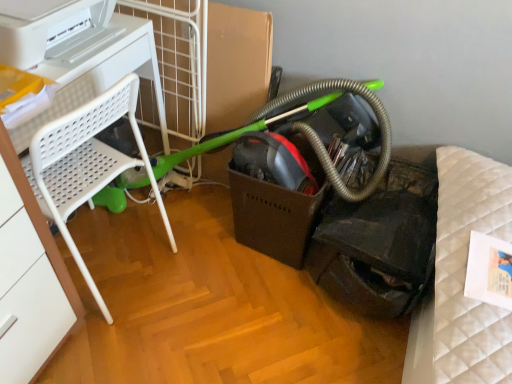
Describe the element at coordinates (81, 57) in the screenshot. This screenshot has width=512, height=384. I see `white plastic chair at left` at that location.

What do you see at coordinates (48, 28) in the screenshot? I see `white plastic printer at upper left` at bounding box center [48, 28].

Measure the distance between white plastic chair at left and camera.

The distance of white plastic chair at left from camera is 38.77 inches.

Image resolution: width=512 pixels, height=384 pixels. Find the location of `white plastic chair at left`. white plastic chair at left is located at coordinates (81, 57).

Which point is more forward, (x=68, y=141) or (x=96, y=196)?

The point (x=68, y=141) is closer.

Is white plastic chair at left wider than green rubber garden hose at center?

Correct, the width of white plastic chair at left exceeds that of green rubber garden hose at center.

From the image's perspective, between white plastic chair at left and green rubber garden hose at center, which one is located above?

green rubber garden hose at center appears higher in the image.

Does white plastic printer at upper left have a lesser height compared to green rubber garden hose at center?

Indeed, white plastic printer at upper left has a lesser height compared to green rubber garden hose at center.

Could you tell me if white plastic printer at upper left is turned towards green rubber garden hose at center?

No, white plastic printer at upper left is not facing towards green rubber garden hose at center.

Is point (84, 34) behind point (260, 127)?

No, (84, 34) is closer to viewer.

Is white plastic printer at upper left to the right of green rubber garden hose at center from the viewer's perspective?

In fact, white plastic printer at upper left is to the left of green rubber garden hose at center.

Considering the relative sizes of green rubber garden hose at center and white plastic printer at upper left in the image provided, is green rubber garden hose at center shorter than white plastic printer at upper left?

Incorrect, the height of green rubber garden hose at center does not fall short of that of white plastic printer at upper left.

Could you tell me if green rubber garden hose at center is facing white plastic printer at upper left?

No.

Considering the sizes of objects green rubber garden hose at center and white plastic printer at upper left in the image provided, who is thinner, green rubber garden hose at center or white plastic printer at upper left?

green rubber garden hose at center is thinner.

In the scene shown: Is green rubber garden hose at center to the left of white plastic printer at upper left from the viewer's perspective?

In fact, green rubber garden hose at center is to the right of white plastic printer at upper left.

Can you see white plastic chair at left touching white plastic printer at upper left?

Yes, white plastic chair at left is right next to white plastic printer at upper left and making contact.

From a real-world perspective, is white plastic chair at left on top of white plastic printer at upper left?

No, from a real-world perspective, white plastic chair at left is not over white plastic printer at upper left

Which object is further away from the camera, white plastic chair at left or white plastic printer at upper left?

white plastic chair at left.

Considering the positions of points (37, 24) and (84, 22), is point (37, 24) closer to camera compared to point (84, 22)?

Yes, point (37, 24) is closer to viewer.

Looking at this image, what's the angular difference between white plastic chair at left and white plastic printer at upper left's facing directions?

The angular difference between white plastic chair at left and white plastic printer at upper left is 174 degrees.

From a real-world perspective, is white plastic chair at left physically located above or below white plastic printer at upper left?

white plastic chair at left is situated lower than white plastic printer at upper left in the real world.

Consider the image. Can you confirm if white plastic chair at left is positioned to the left of white plastic printer at upper left?

No, white plastic chair at left is not to the left of white plastic printer at upper left.

Looking at this image, from a real-world perspective, who is located higher, white plastic chair at left or white plastic chair at left?

From a 3D spatial view, white plastic chair at left is above.

From the image's perspective, which one is positioned lower, white plastic chair at left or white plastic chair at left?

white plastic chair at left appears lower in the image.

Considering the points (117, 80) and (91, 156), which point is in front, point (117, 80) or point (91, 156)?

The point (117, 80) is in front.

Which object is thinner, white plastic chair at left or white plastic chair at left?

white plastic chair at left is thinner.

Between white plastic chair at left and white plastic chair at left, which one has smaller size?

With smaller size is white plastic chair at left.

Considering the positions of points (53, 185) and (60, 30), is point (53, 185) closer to camera compared to point (60, 30)?

That is False.

From a real-world perspective, which is physically below, white plastic chair at left or white plastic chair at left?

From a 3D spatial view, white plastic chair at left is below.

From the image's perspective, who appears lower, white plastic chair at left or white plastic chair at left?

white plastic chair at left.

The height and width of the screenshot is (384, 512). I want to click on furniture that appears on the left of green rubber garden hose at center, so click(x=85, y=164).

Where is `printer that appears in front of the green rubber garden hose at center`? The height and width of the screenshot is (384, 512). printer that appears in front of the green rubber garden hose at center is located at coordinates (48, 28).

Considering their positions, is white plastic printer at upper left positioned closer to green rubber garden hose at center than white plastic chair at left?

white plastic chair at left lies closer to green rubber garden hose at center than the other object.

From the image, which object appears to be farther from white plastic chair at left, green rubber garden hose at center or white plastic chair at left?

green rubber garden hose at center lies further to white plastic chair at left than the other object.

Looking at the image, which one is located closer to white plastic chair at left, white plastic printer at upper left or white plastic chair at left?

The object closer to white plastic chair at left is white plastic chair at left.

When comparing their distances from green rubber garden hose at center, does white plastic printer at upper left or white plastic chair at left seem closer?

white plastic chair at left.

Consider the image. Considering their positions, is white plastic chair at left positioned closer to white plastic printer at upper left than green rubber garden hose at center?

Based on the image, white plastic chair at left appears to be nearer to white plastic printer at upper left.

Based on their spatial positions, is white plastic chair at left or white plastic printer at upper left closer to green rubber garden hose at center?

white plastic chair at left lies closer to green rubber garden hose at center than the other object.

Which object lies further to the anchor point white plastic chair at left, white plastic chair at left or green rubber garden hose at center?

Based on the image, green rubber garden hose at center appears to be further to white plastic chair at left.

Considering their positions, is white plastic chair at left positioned further to white plastic printer at upper left than white plastic chair at left?

white plastic chair at left is positioned further to the anchor white plastic printer at upper left.

In order to click on table between white plastic printer at upper left and white plastic chair at left in the up-down direction in this screenshot , I will do `click(81, 57)`.

The width and height of the screenshot is (512, 384). I want to click on printer between white plastic chair at left and green rubber garden hose at center in the horizontal direction, so click(48, 28).

Where is `furniture situated between white plastic chair at left and green rubber garden hose at center from left to right`? This screenshot has height=384, width=512. furniture situated between white plastic chair at left and green rubber garden hose at center from left to right is located at coordinates (85, 164).

Locate an element on the screen. garden hose between white plastic printer at upper left and white plastic chair at left in the up-down direction is located at coordinates [233, 136].